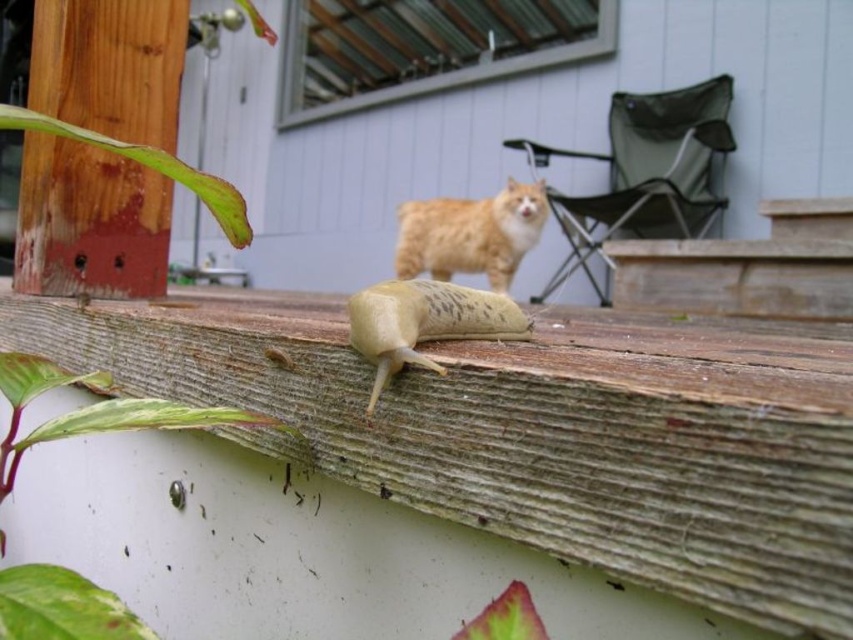
Question: Where is wooden plank at center located in relation to wooden at upper center in the image?

Choices:
 (A) left
 (B) right

Answer: (A)

Question: Can you confirm if wooden plank at center is wider than fuzzy orange cat at center?

Choices:
 (A) yes
 (B) no

Answer: (A)

Question: Considering the real-world distances, which object is closest to the wooden plank at center?

Choices:
 (A) fuzzy orange cat at center
 (B) pale yellow/greenish translucent at center

Answer: (B)

Question: Which object is closer to the camera taking this photo?

Choices:
 (A) wooden at upper center
 (B) wooden plank at center

Answer: (B)

Question: Which point appears closest to the camera in this image?

Choices:
 (A) (398, 346)
 (B) (328, 17)

Answer: (A)

Question: Is wooden at upper center closer to the viewer compared to pale yellow/greenish translucent at center?

Choices:
 (A) no
 (B) yes

Answer: (A)